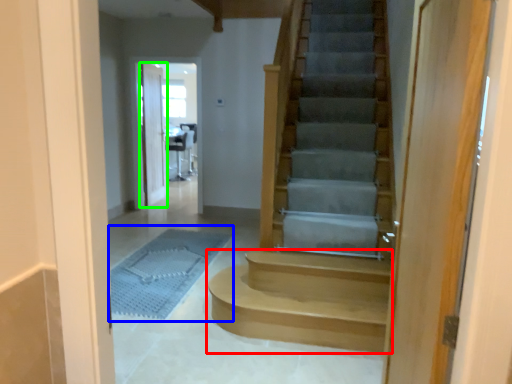
Question: Which object is positioned closest to stairs (highlighted by a red box)? Select from bath mat (highlighted by a blue box) and door (highlighted by a green box).

Choices:
 (A) bath mat
 (B) door

Answer: (A)